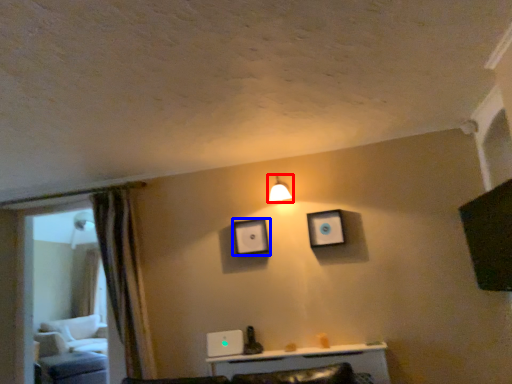
Question: Which object appears closest to the camera in this image, light fixture (highlighted by a red box) or picture frame (highlighted by a blue box)?

Choices:
 (A) light fixture
 (B) picture frame

Answer: (A)